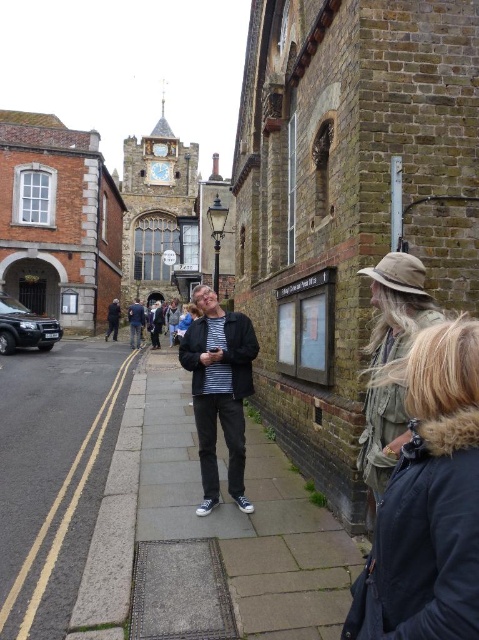
Question: Does dark blue jacket at center appear on the left side of striped shirt at center?

Choices:
 (A) no
 (B) yes

Answer: (B)

Question: Which of the following is the farthest from the observer?

Choices:
 (A) (137, 326)
 (B) (109, 321)
 (C) (49, 572)

Answer: (B)

Question: Which point is closer to the camera?

Choices:
 (A) (111, 308)
 (B) (206, 360)

Answer: (B)

Question: Which point appears farthest from the camera in this image?

Choices:
 (A) (107, 312)
 (B) (43, 404)

Answer: (A)

Question: Where is gray concrete sidewalk at lower left located in relation to striped shirt at center in the image?

Choices:
 (A) above
 (B) below

Answer: (B)

Question: Can you confirm if gray concrete sidewalk at lower left is positioned to the right of dark blue jacket at center?

Choices:
 (A) no
 (B) yes

Answer: (B)